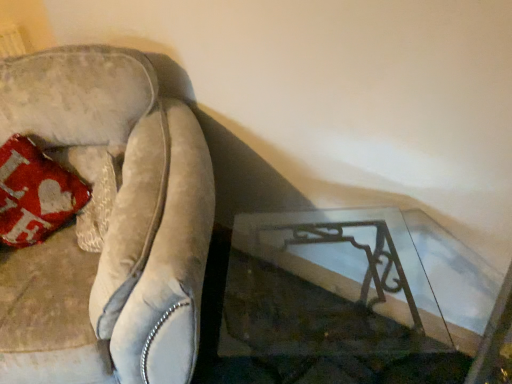
Question: Should I look upward or downward to see velvet couch at left?

Choices:
 (A) down
 (B) up

Answer: (A)

Question: Considering the relative sizes of velvet couch at left and clear glass table at lower right in the image provided, is velvet couch at left smaller than clear glass table at lower right?

Choices:
 (A) yes
 (B) no

Answer: (B)

Question: Does velvet couch at left have a larger size compared to clear glass table at lower right?

Choices:
 (A) no
 (B) yes

Answer: (B)

Question: From the image's perspective, is velvet couch at left located above clear glass table at lower right?

Choices:
 (A) yes
 (B) no

Answer: (A)

Question: From a real-world perspective, does velvet couch at left sit lower than clear glass table at lower right?

Choices:
 (A) yes
 (B) no

Answer: (B)

Question: From a real-world perspective, does velvet couch at left stand above clear glass table at lower right?

Choices:
 (A) yes
 (B) no

Answer: (A)

Question: Is velvet couch at left with clear glass table at lower right?

Choices:
 (A) no
 (B) yes

Answer: (A)

Question: Does clear glass table at lower right have a smaller size compared to velvet couch at left?

Choices:
 (A) yes
 (B) no

Answer: (A)

Question: Is clear glass table at lower right outside of velvet couch at left?

Choices:
 (A) no
 (B) yes

Answer: (B)

Question: Is clear glass table at lower right next to velvet couch at left and touching it?

Choices:
 (A) no
 (B) yes

Answer: (A)

Question: Is clear glass table at lower right positioned with its back to velvet couch at left?

Choices:
 (A) yes
 (B) no

Answer: (B)

Question: From a real-world perspective, is clear glass table at lower right located higher than velvet couch at left?

Choices:
 (A) yes
 (B) no

Answer: (B)

Question: From the image's perspective, is clear glass table at lower right below velvet couch at left?

Choices:
 (A) yes
 (B) no

Answer: (A)

Question: Considering their positions, is velvet couch at left located in front of or behind clear glass table at lower right?

Choices:
 (A) behind
 (B) front

Answer: (A)